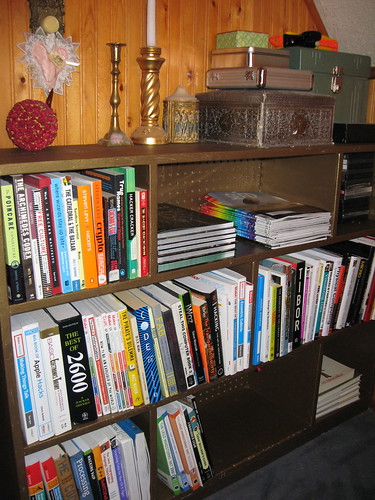
You are a GUI agent. You are given a task and a screenshot of the screen. Output one action in this format:
    pyautogui.click(x=<x>, y=<y>)
    Task: Click on the decorative ornaments
    This screenshot has width=375, height=500.
    Given the screenshot: What is the action you would take?
    pyautogui.click(x=149, y=92), pyautogui.click(x=112, y=96), pyautogui.click(x=178, y=119), pyautogui.click(x=31, y=122)